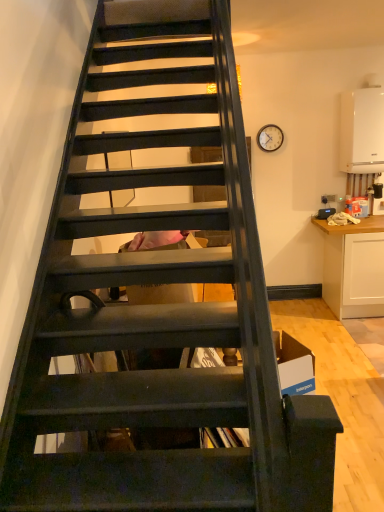
What is the approximate height of matte brown clock at upper right?

matte brown clock at upper right is 28.69 centimeters in height.

Locate an element on the screen. The height and width of the screenshot is (512, 384). matte brown clock at upper right is located at coordinates (270, 138).

At what (x,y) coordinates should I click in order to perform the action: click on white matte cabinet at right. Please return your answer as a coordinate pair (x, y). The width and height of the screenshot is (384, 512). Looking at the image, I should click on (354, 267).

Locate an element on the screen. Image resolution: width=384 pixels, height=512 pixels. matte brown clock at upper right is located at coordinates (270, 138).

Is white matte cabinet at right smaller than matte brown clock at upper right?

Incorrect, white matte cabinet at right is not smaller in size than matte brown clock at upper right.

Consider the image. Is white matte cabinet at right inside the boundaries of matte brown clock at upper right, or outside?

white matte cabinet at right is located beyond the bounds of matte brown clock at upper right.

From a real-world perspective, is white matte cabinet at right above or below matte brown clock at upper right?

From a real-world perspective, white matte cabinet at right is physically below matte brown clock at upper right.

Considering the positions of point (357, 253) and point (274, 124), is point (357, 253) closer or farther from the camera than point (274, 124)?

Point (357, 253) appears to be closer to the viewer than point (274, 124).

Is white matte cabinet at right taller or shorter than white matte boiler at upper right?

Clearly, white matte cabinet at right is taller compared to white matte boiler at upper right.

Is point (379, 251) less distant than point (353, 167)?

Yes, it is in front of point (353, 167).

Considering the relative positions of white matte cabinet at right and white matte boiler at upper right in the image provided, is white matte cabinet at right in front of white matte boiler at upper right?

That is False.

Consider the image. From the image's perspective, is matte brown clock at upper right over white matte cabinet at right?

Yes, from the image's perspective, matte brown clock at upper right is above white matte cabinet at right.

How distant is matte brown clock at upper right from white matte cabinet at right?

A distance of 4.65 feet exists between matte brown clock at upper right and white matte cabinet at right.

Does matte brown clock at upper right have a smaller size compared to white matte cabinet at right?

Yes.

Is point (372, 153) closer to camera compared to point (379, 241)?

Yes.

Does white matte boiler at upper right appear on the right side of white matte cabinet at right?

No.

Are white matte boiler at upper right and white matte cabinet at right making contact?

No.

Is white matte boiler at upper right aimed at white matte cabinet at right?

No, white matte boiler at upper right does not turn towards white matte cabinet at right.

From the image's perspective, is matte brown clock at upper right located above or below white matte boiler at upper right?

matte brown clock at upper right is situated lower than white matte boiler at upper right in the image.

Can we say matte brown clock at upper right lies outside white matte boiler at upper right?

matte brown clock at upper right lies outside white matte boiler at upper right's area.

Is matte brown clock at upper right next to white matte boiler at upper right and touching it?

No, matte brown clock at upper right is not in contact with white matte boiler at upper right.

From a real-world perspective, is white matte boiler at upper right under matte brown clock at upper right?

Correct, in the physical world, white matte boiler at upper right is lower than matte brown clock at upper right.

Identify the location of clock that appears on the left of white matte boiler at upper right. The image size is (384, 512). 270,138.

From the image's perspective, between white matte boiler at upper right and matte brown clock at upper right, which one is located above?

white matte boiler at upper right is shown above in the image.

In the scene shown: Between white matte boiler at upper right and matte brown clock at upper right, which one is positioned behind?

Positioned behind is matte brown clock at upper right.

Locate an element on the screen. The height and width of the screenshot is (512, 384). cabinetry that appears in front of the matte brown clock at upper right is located at coordinates (354, 267).

Identify the location of appliance on the left of white matte cabinet at right. (362, 131).

Looking at the image, which one is located closer to white matte boiler at upper right, white matte cabinet at right or matte brown clock at upper right?

The object closer to white matte boiler at upper right is matte brown clock at upper right.

Based on their spatial positions, is white matte cabinet at right or white matte boiler at upper right further from matte brown clock at upper right?

white matte cabinet at right lies further to matte brown clock at upper right than the other object.

Consider the image. Based on their spatial positions, is matte brown clock at upper right or white matte boiler at upper right further from white matte cabinet at right?

Based on the image, matte brown clock at upper right appears to be further to white matte cabinet at right.

Estimate the real-world distances between objects in this image. Which object is further from white matte cabinet at right, white matte boiler at upper right or matte brown clock at upper right?

matte brown clock at upper right lies further to white matte cabinet at right than the other object.

From the image, which object appears to be farther from white matte boiler at upper right, matte brown clock at upper right or white matte cabinet at right?

white matte cabinet at right lies further to white matte boiler at upper right than the other object.

Considering their positions, is white matte boiler at upper right positioned further to matte brown clock at upper right than white matte cabinet at right?

Among the two, white matte cabinet at right is located further to matte brown clock at upper right.

This screenshot has height=512, width=384. I want to click on clock between white matte boiler at upper right and white matte cabinet at right in the vertical direction, so click(270, 138).